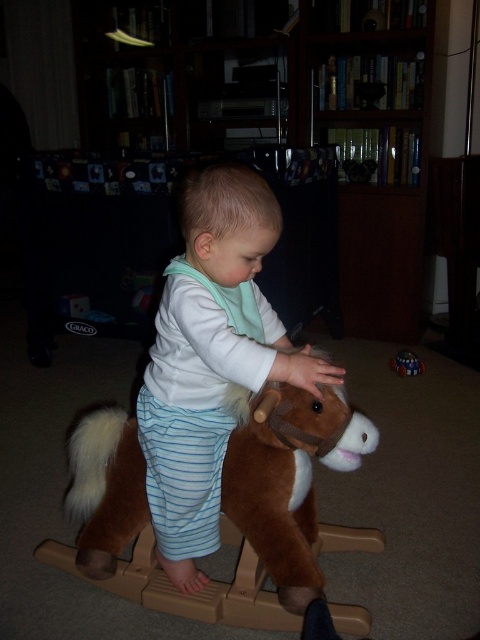
Question: Which point is closer to the camera?

Choices:
 (A) white soft toddler at center
 (B) shiny metallic ball at center
 (C) wooden bookshelf at upper center

Answer: (A)

Question: Is wooden bookshelf at upper center wider than shiny metallic ball at center?

Choices:
 (A) no
 (B) yes

Answer: (B)

Question: Which object appears closest to the camera in this image?

Choices:
 (A) wooden bookshelf at upper center
 (B) shiny metallic ball at center
 (C) white soft toddler at center

Answer: (C)

Question: From the image, what is the correct spatial relationship of wooden bookshelf at upper center in relation to white soft toddler at center?

Choices:
 (A) above
 (B) below

Answer: (A)

Question: Can you confirm if wooden bookshelf at upper center is positioned below shiny metallic ball at center?

Choices:
 (A) no
 (B) yes

Answer: (A)

Question: Among these points, which one is nearest to the camera?

Choices:
 (A) (396, 365)
 (B) (263, 236)

Answer: (B)